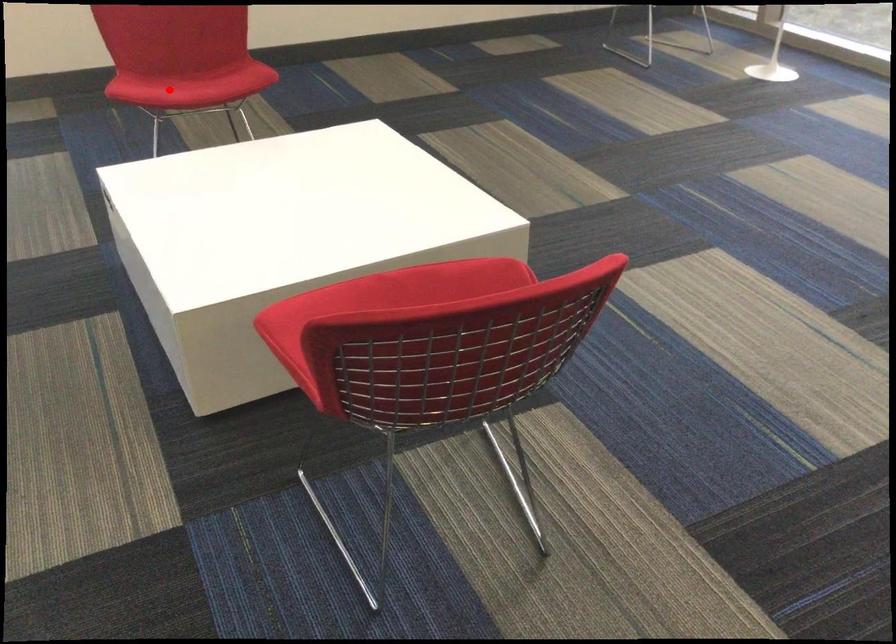
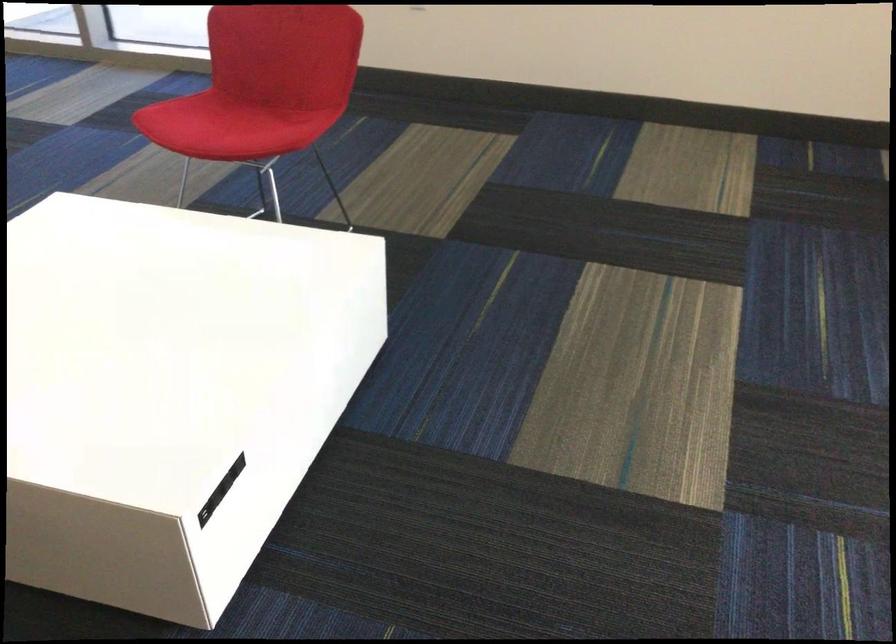
Question: I am providing you with two images of the same scene from different viewpoints. Image1 has a red point marked. In image2, the corresponding 3D location appears at what relative position? Reply with the corresponding letter.

Choices:
 (A) Closer
 (B) Farther

Answer: (A)